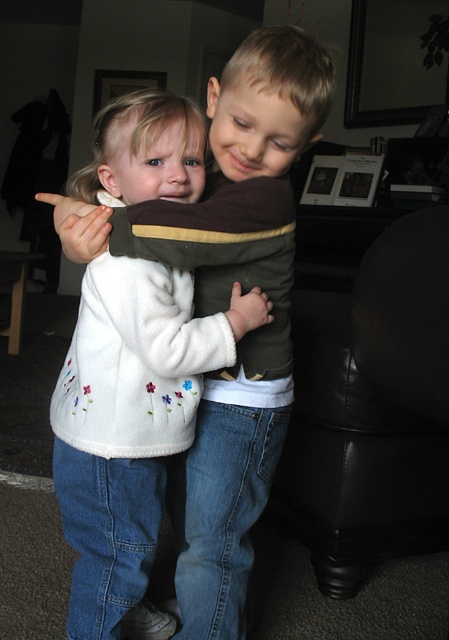
Between white fleece sweater at center and black leather armchair at right, which one is positioned lower?

black leather armchair at right is lower down.

Can you confirm if white fleece sweater at center is positioned below black leather armchair at right?

No.

Locate an element on the screen. white fleece sweater at center is located at coordinates (130, 422).